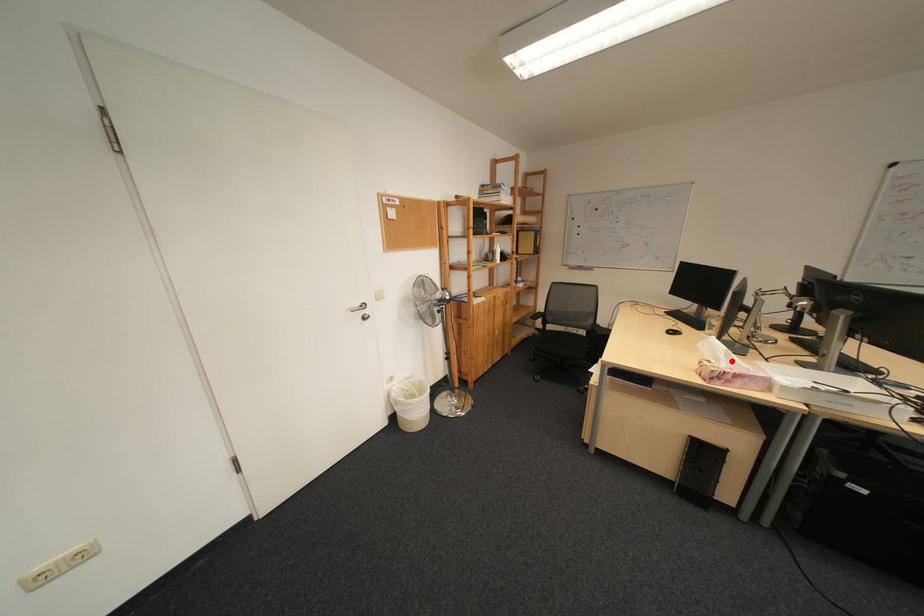
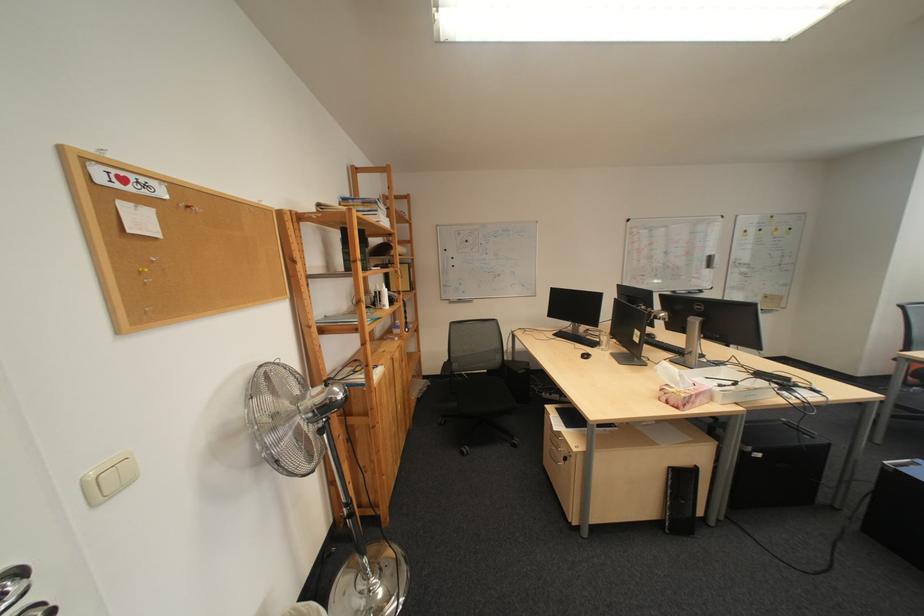
The point at the highlighted location is marked in the first image. Where is the corresponding point in the second image?

(690, 385)